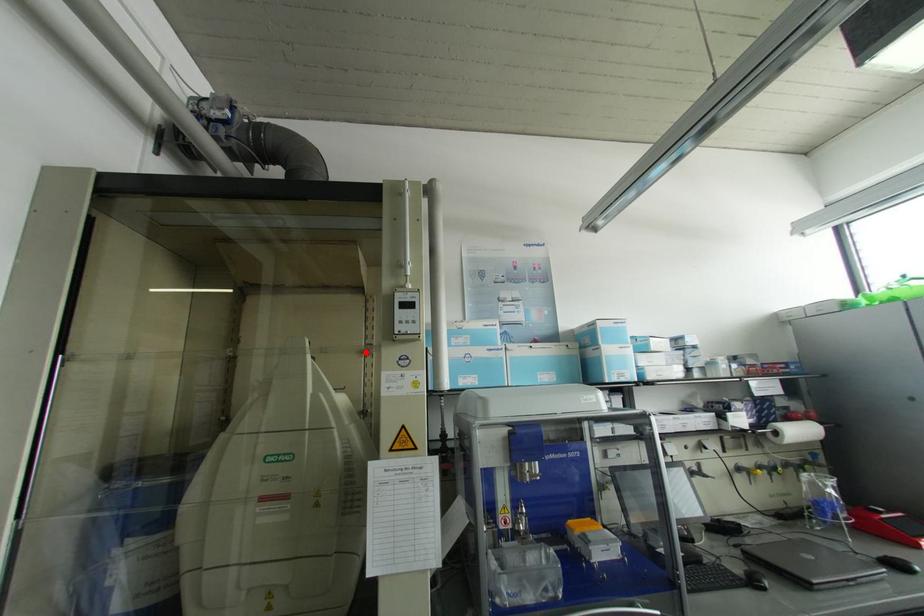
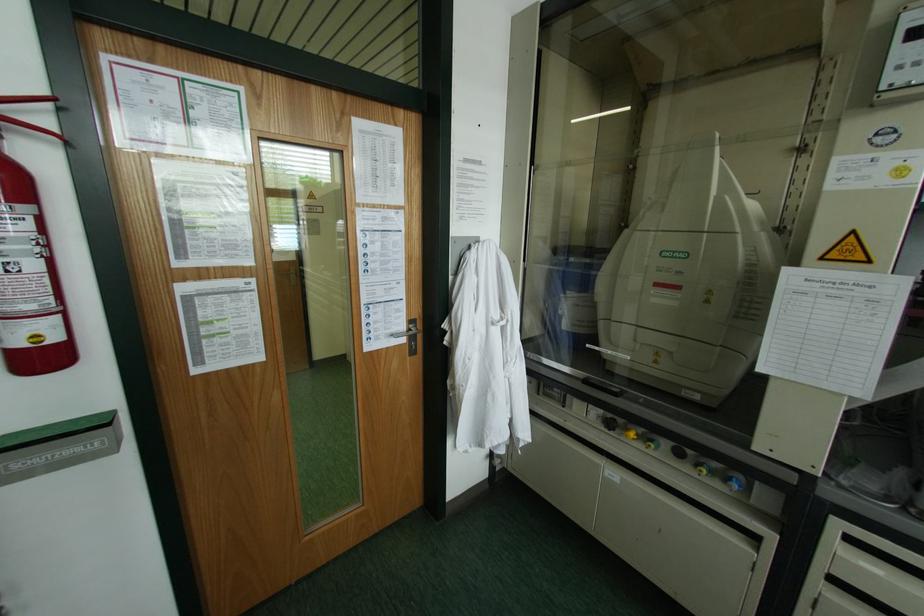
Find the pixel in the second image that matches the highlighted location in the first image.

(800, 148)